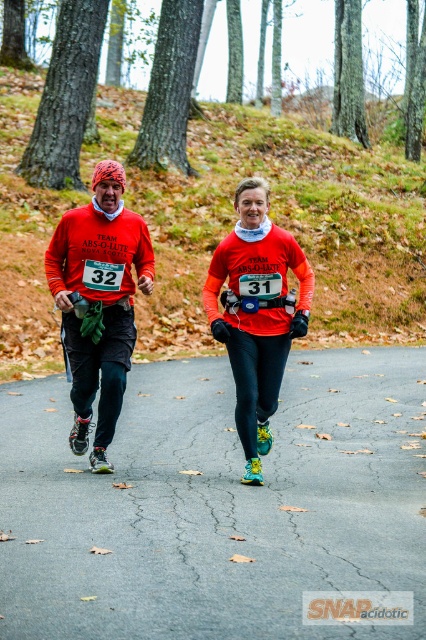
Find the location of a particular element. The height and width of the screenshot is (640, 426). green mossy hillside at upper center is located at coordinates (287, 228).

Which of these two, green mossy hillside at upper center or matte red running shirt at center, stands taller?

green mossy hillside at upper center is taller.

The width and height of the screenshot is (426, 640). I want to click on green mossy hillside at upper center, so click(x=287, y=228).

Is gray asphalt road at center positioned in front of green mossy hillside at upper center?

Yes, gray asphalt road at center is closer to the viewer.

Is gray asphalt road at center below green mossy hillside at upper center?

Yes, gray asphalt road at center is below green mossy hillside at upper center.

Find the location of a particular element. This screenshot has height=640, width=426. gray asphalt road at center is located at coordinates (216, 504).

Where is `gray asphalt road at center`? The width and height of the screenshot is (426, 640). gray asphalt road at center is located at coordinates (216, 504).

Can you confirm if gray asphalt road at center is positioned to the left of matte red shirt at center?

In fact, gray asphalt road at center is to the right of matte red shirt at center.

Can you confirm if gray asphalt road at center is positioned below matte red shirt at center?

Yes, gray asphalt road at center is below matte red shirt at center.

Where is `gray asphalt road at center`? Image resolution: width=426 pixels, height=640 pixels. gray asphalt road at center is located at coordinates (216, 504).